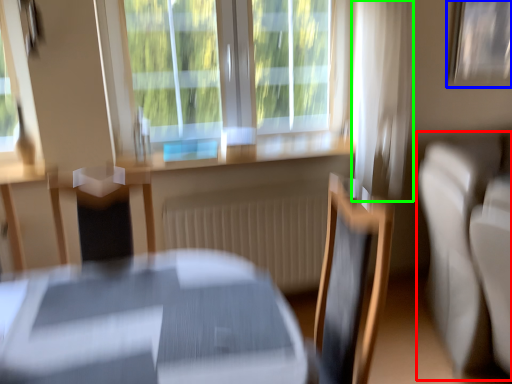
Question: Which object is positioned closest to couch (highlighted by a red box)? Select from picture frame (highlighted by a blue box) and curtain (highlighted by a green box).

Choices:
 (A) picture frame
 (B) curtain

Answer: (B)